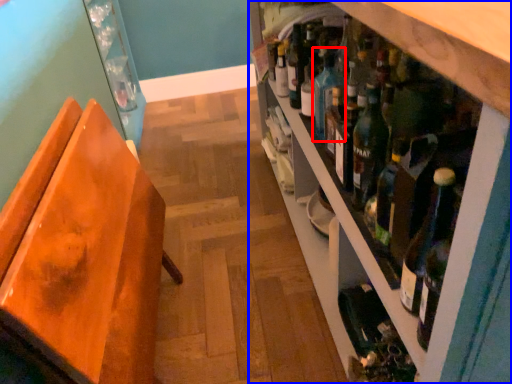
Question: Among these objects, which one is farthest to the camera, teal (highlighted by a red box) or shelf (highlighted by a blue box)?

Choices:
 (A) teal
 (B) shelf

Answer: (A)